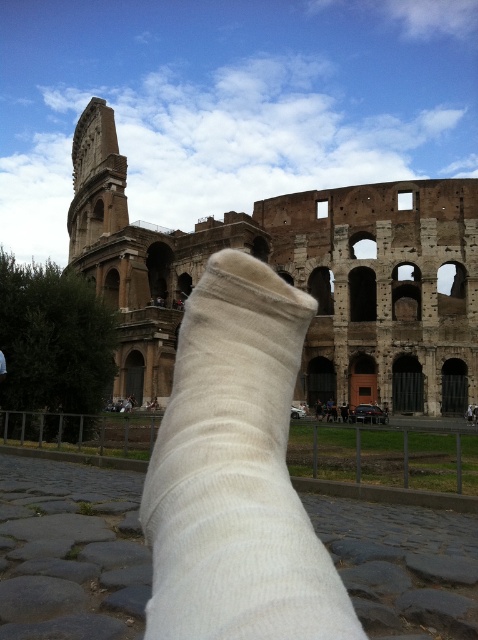
You are standing in front of the Colosseum and see the point marked at coordinates (296, 276). What does this point indicate?

The point at coordinates (296, 276) marks the brown stone amphitheater at center.

You are standing in Rome and want to take a photo of the brown stone amphitheater at center. If you have a camera with a 50mm lens, which is ideal for capturing subjects at a distance of about 10 feet, would you need to move closer or farther away to properly frame the amphitheater?

The brown stone amphitheater at center is 218.17 feet away from you. Since a 50mm lens is ideal for subjects around 10 feet, you would need to move much closer to properly frame the amphitheater.

You are a tourist visiting the Colosseum and see the brown stone amphitheater at center and the white cotton sock at center. Which object is located to the right side?

The white cotton sock at center is located to the right side of the brown stone amphitheater at center.